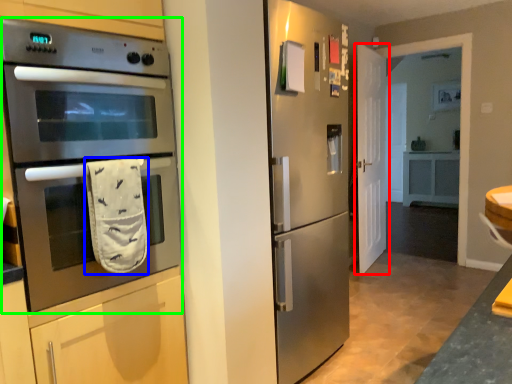
Question: Based on their relative distances, which object is nearer to door (highlighted by a red box)? Choose from hand towel (highlighted by a blue box) and microwave oven (highlighted by a green box).

Choices:
 (A) hand towel
 (B) microwave oven

Answer: (B)